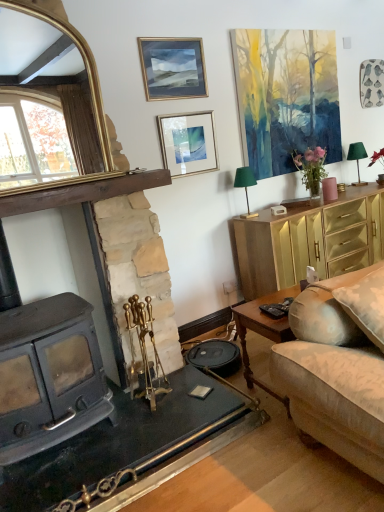
Question: From a real-world perspective, is watercolor painting at upper right, the first picture frame positioned from the right, physically below green fabric lampshade at upper right, marked as the 1th lamp in a front-to-back arrangement?

Choices:
 (A) yes
 (B) no

Answer: (B)

Question: Is watercolor painting at upper right, the third picture frame positioned from the left, outside green fabric lampshade at upper right, acting as the 2th lamp starting from the right?

Choices:
 (A) no
 (B) yes

Answer: (B)

Question: From the image's perspective, is watercolor painting at upper right, the third picture frame positioned from the left, on top of green fabric lampshade at upper right, marked as the 1th lamp in a front-to-back arrangement?

Choices:
 (A) no
 (B) yes

Answer: (B)

Question: Is watercolor painting at upper right, the third picture frame positioned from the left, in front of green fabric lampshade at upper right, acting as the 2th lamp starting from the back?

Choices:
 (A) yes
 (B) no

Answer: (B)

Question: Is watercolor painting at upper right, the first picture frame positioned from the right, wider than green fabric lampshade at upper right, placed as the 1th lamp when sorted from left to right?

Choices:
 (A) no
 (B) yes

Answer: (A)

Question: In terms of size, does gold metallic cabinet at right appear bigger or smaller than pink matte vase at upper right?

Choices:
 (A) big
 (B) small

Answer: (A)

Question: In the image, is gold metallic cabinet at right on the left side or the right side of pink matte vase at upper right?

Choices:
 (A) right
 (B) left

Answer: (A)

Question: From a real-world perspective, is gold metallic cabinet at right positioned above or below pink matte vase at upper right?

Choices:
 (A) below
 (B) above

Answer: (A)

Question: Considering the positions of gold metallic cabinet at right and pink matte vase at upper right in the image, is gold metallic cabinet at right taller or shorter than pink matte vase at upper right?

Choices:
 (A) tall
 (B) short

Answer: (A)

Question: Is point (248, 310) positioned closer to the camera than point (327, 189)?

Choices:
 (A) closer
 (B) farther

Answer: (A)

Question: From a real-world perspective, is wooden coffee table at lower right positioned above or below pink matte vase at upper right?

Choices:
 (A) above
 (B) below

Answer: (B)

Question: From their relative heights in the image, would you say wooden coffee table at lower right is taller or shorter than pink matte vase at upper right?

Choices:
 (A) short
 (B) tall

Answer: (B)

Question: From the image's perspective, is wooden coffee table at lower right located above or below pink matte vase at upper right?

Choices:
 (A) above
 (B) below

Answer: (B)

Question: Considering their positions, is pink matte vase at upper right located in front of or behind watercolor painting at upper right, the third picture frame positioned from the left?

Choices:
 (A) behind
 (B) front

Answer: (A)

Question: Is pink matte vase at upper right inside the boundaries of watercolor painting at upper right, the third picture frame positioned from the left, or outside?

Choices:
 (A) inside
 (B) outside

Answer: (B)